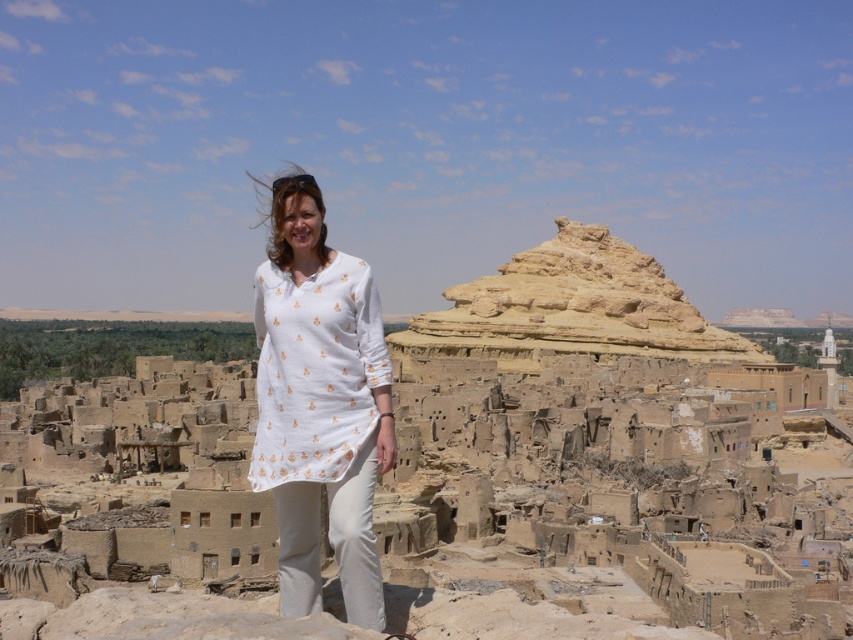
Does white cotton dress at center appear over earthy brown stone pyramid at center?

Actually, white cotton dress at center is below earthy brown stone pyramid at center.

Between point (369, 580) and point (473, 349), which one is positioned in front?

Point (369, 580) is more forward.

Locate an element on the screen. The image size is (853, 640). white cotton dress at center is located at coordinates (320, 403).